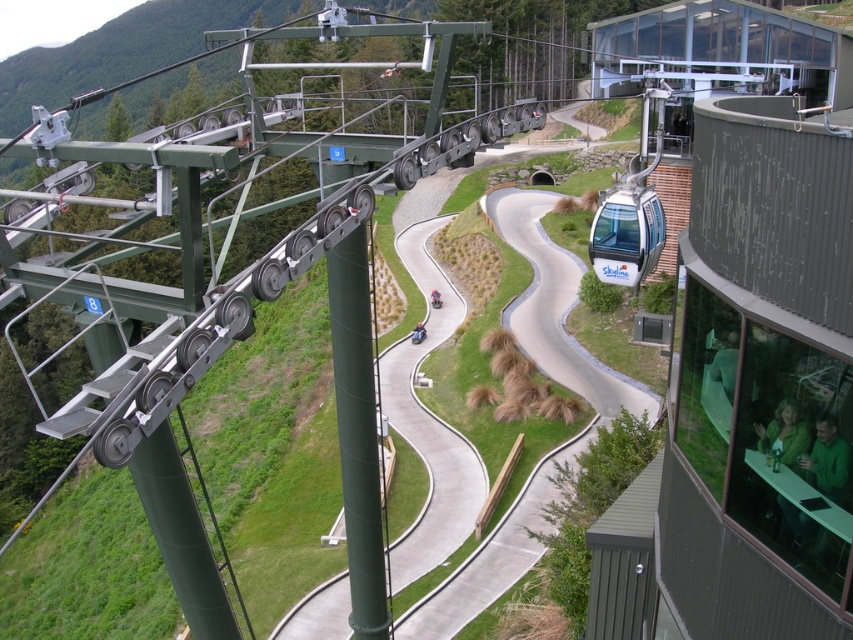
Which is above, green matte pole at center or white glossy cable car at center-right?

Positioned higher is white glossy cable car at center-right.

Between green matte pole at center and white glossy cable car at center-right, which one appears on the right side from the viewer's perspective?

white glossy cable car at center-right is more to the right.

Is point (363, 406) positioned before point (631, 266)?

Yes, it is in front of point (631, 266).

The width and height of the screenshot is (853, 640). I want to click on green matte pole at center, so click(357, 433).